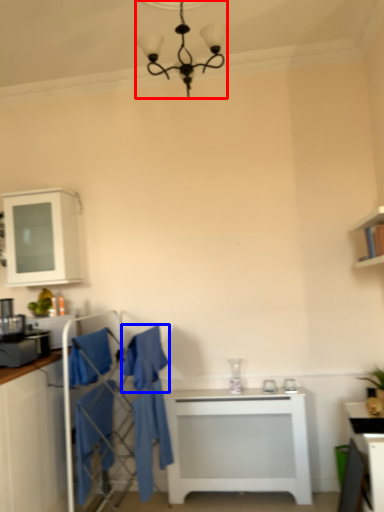
Question: Which object appears farthest to the camera in this image, light fixture (highlighted by a red box) or robe (highlighted by a blue box)?

Choices:
 (A) light fixture
 (B) robe

Answer: (B)